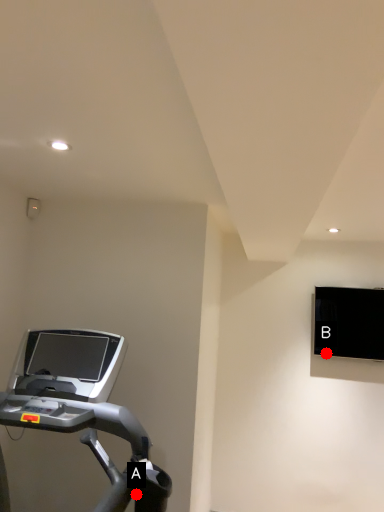
Question: Two points are circled on the image, labeled by A and B beside each circle. Which point is further to the camera?

Choices:
 (A) A is further
 (B) B is further

Answer: (B)